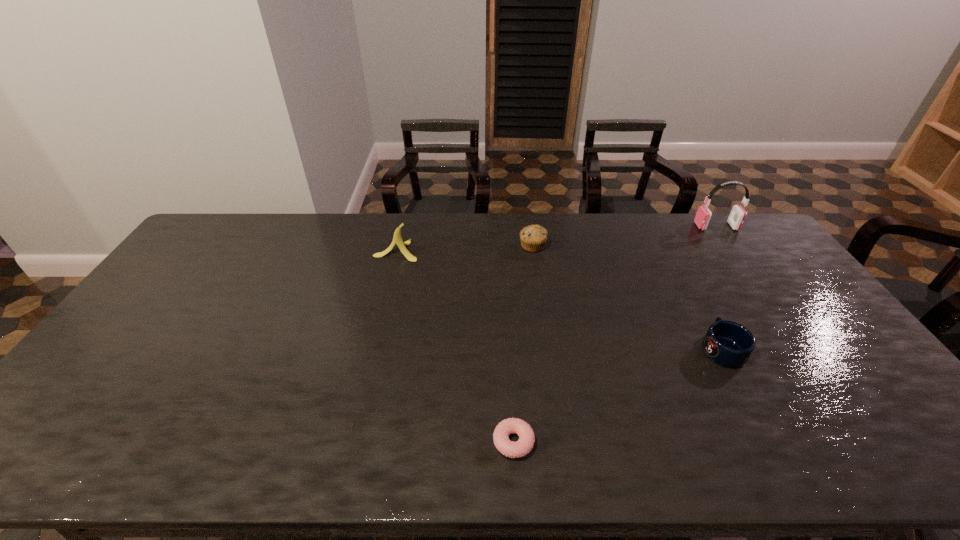
Identify the location of muffin at the far edge. [x=533, y=238].

This screenshot has width=960, height=540. I want to click on object that is at the near edge, so click(x=520, y=448).

Find the location of `object at the right edge`. object at the right edge is located at coordinates (737, 216).

At what (x,y) coordinates should I click in order to perform the action: click on object present at the far right corner. Please return your answer as a coordinate pair (x, y). The image size is (960, 540). Looking at the image, I should click on (737, 216).

Find the location of a particular element. free space at the far edge of the desktop is located at coordinates (596, 245).

Where is `vacant space at the near edge`? This screenshot has height=540, width=960. vacant space at the near edge is located at coordinates (582, 465).

You are a GUI agent. You are given a task and a screenshot of the screen. Output one action in this format:
    pyautogui.click(x=<x>, y=<y>)
    Task: Click on the vacant space at the left edge
    This screenshot has width=960, height=540.
    Given the screenshot: What is the action you would take?
    pyautogui.click(x=213, y=260)

You are a GUI agent. You are given a task and a screenshot of the screen. Output one action in this format:
    pyautogui.click(x=<x>, y=<y>)
    Task: Click on the free space at the right edge of the desktop
    
    Given the screenshot: What is the action you would take?
    pyautogui.click(x=783, y=280)

The height and width of the screenshot is (540, 960). Find the location of `free spot between the fourth tallest object and the third object from right to left`. free spot between the fourth tallest object and the third object from right to left is located at coordinates (627, 297).

At what (x,y) coordinates should I click in order to perform the action: click on free point between the leftmost object and the mug. Please return your answer as a coordinate pair (x, y). The width and height of the screenshot is (960, 540). Looking at the image, I should click on (559, 300).